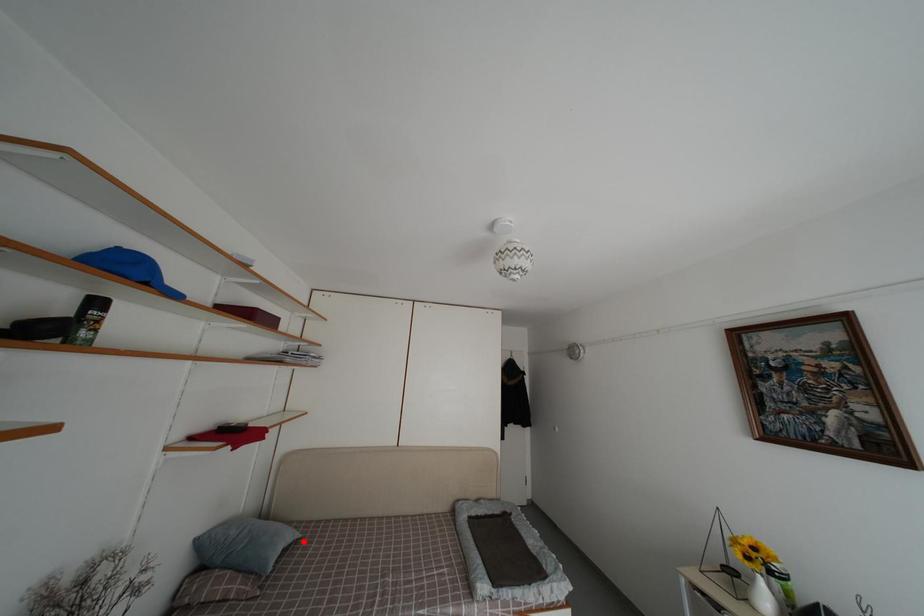
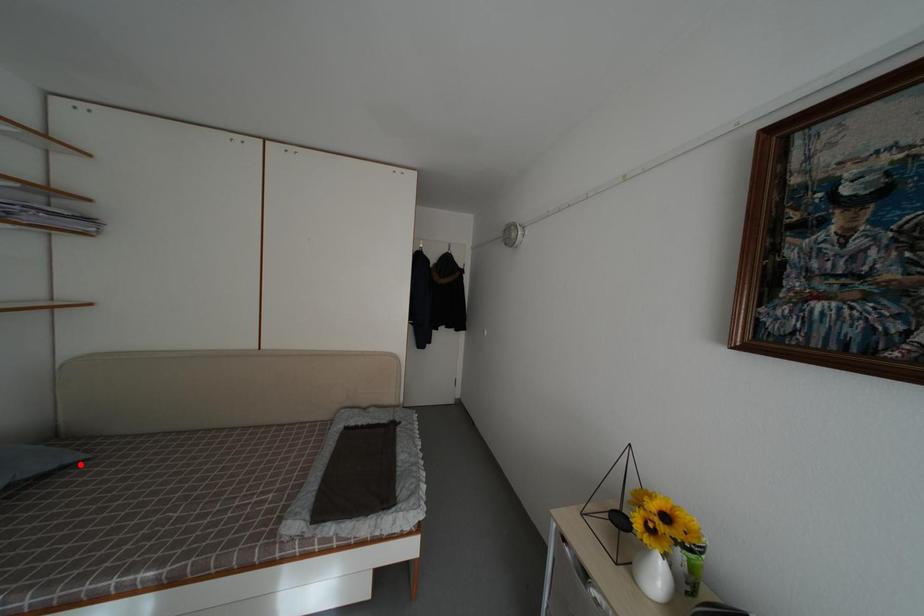
I am providing you with two images of the same scene from different viewpoints. A red point is marked on the first image and another point is marked on the second image. Is the marked point in image1 the same physical position as the marked point in image2?

Yes